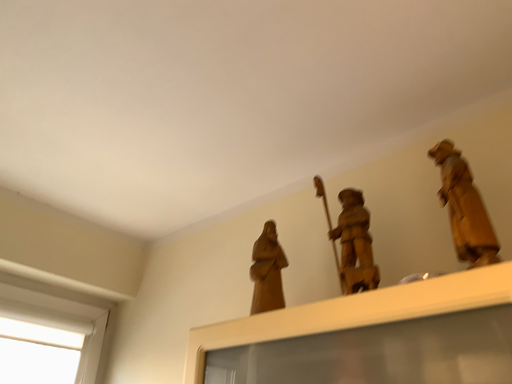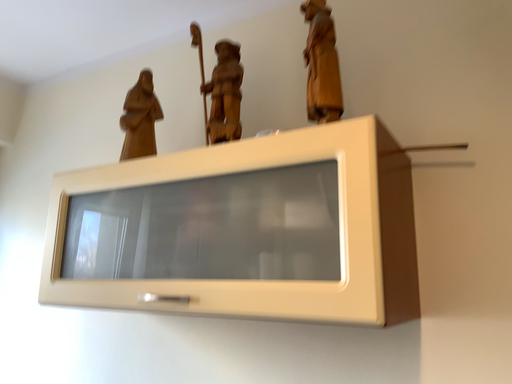
Question: How did the camera likely rotate when shooting the video?

Choices:
 (A) rotated upward
 (B) rotated downward

Answer: (B)